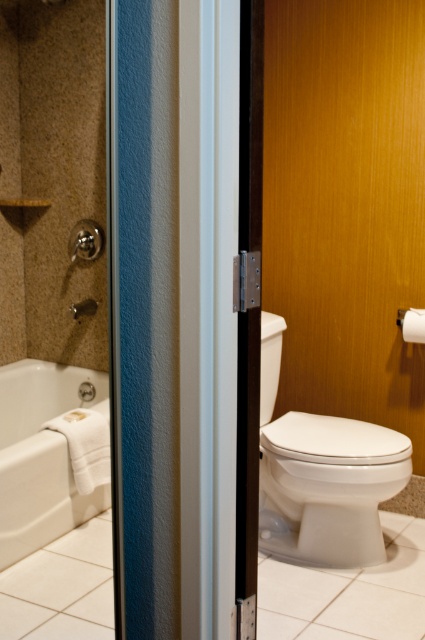
Is white glossy toilet at right taller than matte silver shower at left?

Yes.

Does white glossy toilet at right appear on the left side of matte silver shower at left?

In fact, white glossy toilet at right is to the right of matte silver shower at left.

Locate an element on the screen. This screenshot has width=425, height=640. white glossy toilet at right is located at coordinates (323, 476).

Between white glossy bathtub at lower left and matte silver shower at left, which one has more height?

white glossy bathtub at lower left

Can you confirm if white glossy bathtub at lower left is taller than matte silver shower at left?

Yes, white glossy bathtub at lower left is taller than matte silver shower at left.

Which is in front, point (5, 444) or point (87, 304)?

Positioned in front is point (5, 444).

Find the location of a particular element. The image size is (425, 640). white glossy bathtub at lower left is located at coordinates (42, 456).

Is white glossy toilet at right above white glossy bathtub at lower left?

Indeed, white glossy toilet at right is positioned over white glossy bathtub at lower left.

Between point (336, 490) and point (31, 397), which one is positioned in front?

Positioned in front is point (336, 490).

Identify the location of white glossy toilet at right. This screenshot has width=425, height=640. (323, 476).